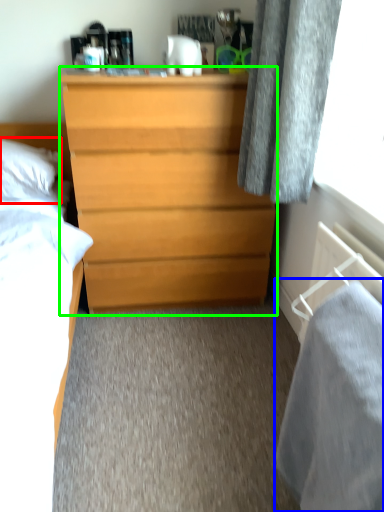
Question: Which is farther away from pillow (highlighted by a red box)? sheet (highlighted by a blue box) or chest of drawers (highlighted by a green box)?

Choices:
 (A) sheet
 (B) chest of drawers

Answer: (A)